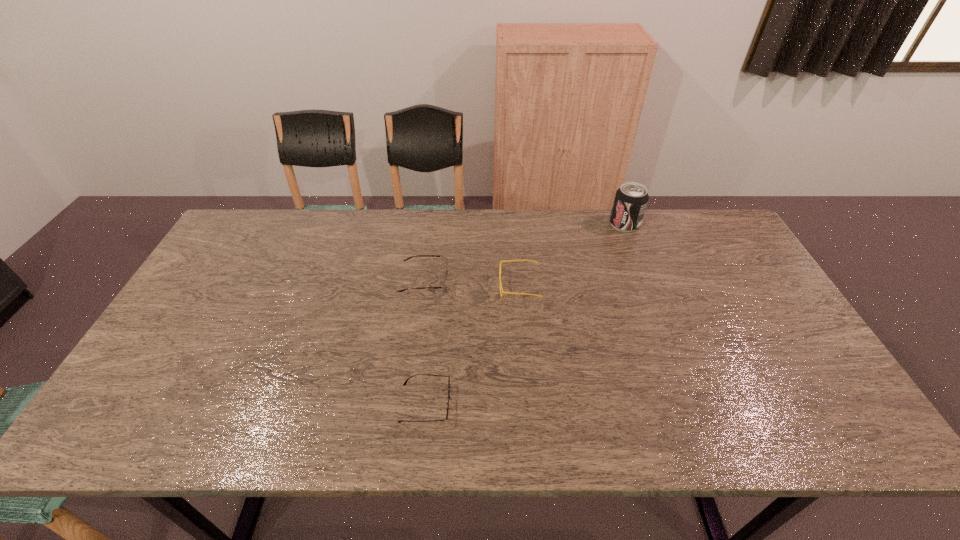
I want to click on free space between the nearest spectacles and the rightmost object, so click(525, 313).

Find the location of a particular element. free spot between the shortest object and the rightmost spectacles is located at coordinates (472, 345).

Find the location of `vacant point located between the soda can and the rightmost spectacles`. vacant point located between the soda can and the rightmost spectacles is located at coordinates coord(572,255).

In order to click on vacant point located between the rightmost object and the rightmost spectacles in this screenshot , I will do `click(572, 255)`.

I want to click on object that is the closest to the nearest spectacles, so click(444, 286).

This screenshot has height=540, width=960. Identify the location of the closest object relative to the rightmost object. click(x=536, y=262).

Select which spectacles is the second closest to the tallest object. Please provide its 2D coordinates. Your answer should be formatted as a tuple, i.e. [(x, y)], where the tuple contains the x and y coordinates of a point satisfying the conditions above.

[(444, 286)]

Identify which spectacles is the second closest to the shortest spectacles. Please provide its 2D coordinates. Your answer should be formatted as a tuple, i.e. [(x, y)], where the tuple contains the x and y coordinates of a point satisfying the conditions above.

[(536, 262)]